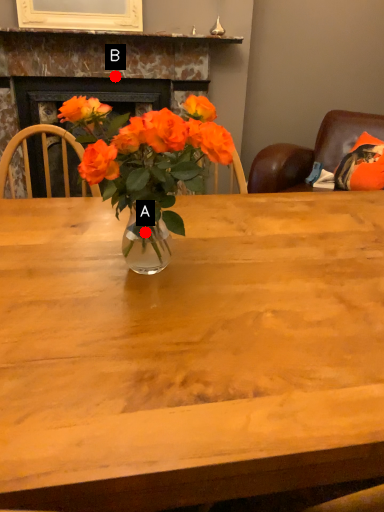
Question: Two points are circled on the image, labeled by A and B beside each circle. Which point appears farthest from the camera in this image?

Choices:
 (A) A is further
 (B) B is further

Answer: (B)